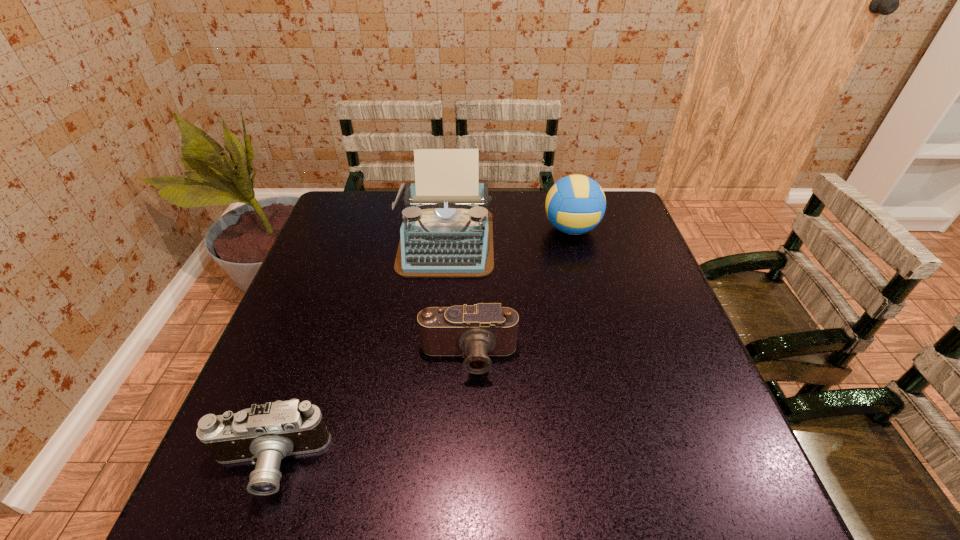
Where is `free space between the typewriter and the right camera`? The image size is (960, 540). free space between the typewriter and the right camera is located at coordinates (457, 299).

The image size is (960, 540). In order to click on free space between the left camera and the typewriter in this screenshot , I will do click(x=357, y=352).

Locate an element on the screen. The height and width of the screenshot is (540, 960). vacant space that is in between the leftmost object and the second nearest object is located at coordinates (369, 410).

The image size is (960, 540). What are the coordinates of `free spot between the left camera and the volleyball` in the screenshot? It's located at (420, 347).

Identify the location of object that is the third nearest to the right camera. (575, 204).

At what (x,y) coordinates should I click in order to perform the action: click on object that is the third closest to the left camera. Please return your answer as a coordinate pair (x, y). The width and height of the screenshot is (960, 540). Looking at the image, I should click on point(575,204).